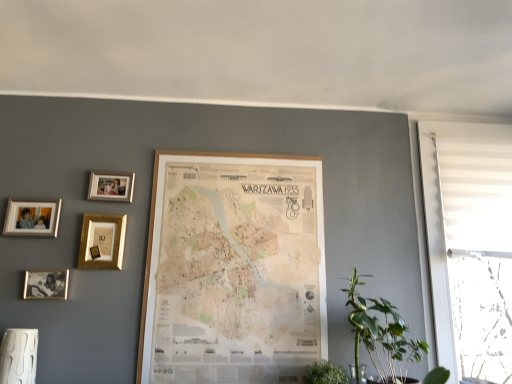
Question: Should I look upward or downward to see wooden map at center, which is the 1th picture frame from right to left?

Choices:
 (A) down
 (B) up

Answer: (A)

Question: Should I look upward or downward to see white fabric window at right?

Choices:
 (A) up
 (B) down

Answer: (B)

Question: Considering the relative sizes of gold metallic picture frame at upper left, arranged as the 3th picture frame when viewed from the right, and silver metallic photo frame at upper left, arranged as the 1th picture frame when viewed from the left, in the image provided, is gold metallic picture frame at upper left, arranged as the 3th picture frame when viewed from the right, shorter than silver metallic photo frame at upper left, arranged as the 1th picture frame when viewed from the left,?

Choices:
 (A) yes
 (B) no

Answer: (B)

Question: Is gold metallic picture frame at upper left, arranged as the 3th picture frame when viewed from the right, thinner than silver metallic photo frame at upper left, the 5th picture frame when ordered from right to left?

Choices:
 (A) no
 (B) yes

Answer: (A)

Question: Considering the relative sizes of gold metallic picture frame at upper left, placed as the third picture frame when sorted from left to right, and silver metallic photo frame at upper left, arranged as the 1th picture frame when viewed from the left, in the image provided, is gold metallic picture frame at upper left, placed as the third picture frame when sorted from left to right, wider than silver metallic photo frame at upper left, arranged as the 1th picture frame when viewed from the left,?

Choices:
 (A) yes
 (B) no

Answer: (A)

Question: From the image's perspective, would you say gold metallic picture frame at upper left, placed as the third picture frame when sorted from left to right, is shown under silver metallic photo frame at upper left, arranged as the 1th picture frame when viewed from the left?

Choices:
 (A) yes
 (B) no

Answer: (A)

Question: Can you confirm if gold metallic picture frame at upper left, arranged as the 3th picture frame when viewed from the right, is bigger than silver metallic photo frame at upper left, the 5th picture frame when ordered from right to left?

Choices:
 (A) yes
 (B) no

Answer: (A)

Question: Can you confirm if gold metallic picture frame at upper left, placed as the third picture frame when sorted from left to right, is smaller than silver metallic photo frame at upper left, arranged as the 1th picture frame when viewed from the left?

Choices:
 (A) yes
 (B) no

Answer: (B)

Question: Is green leafy plant at lower right behind gold metallic photo frame at upper left, the second picture frame in the right-to-left sequence?

Choices:
 (A) no
 (B) yes

Answer: (A)

Question: From a real-world perspective, is green leafy plant at lower right positioned over gold metallic photo frame at upper left, the second picture frame in the right-to-left sequence, based on gravity?

Choices:
 (A) no
 (B) yes

Answer: (A)

Question: Is gold metallic photo frame at upper left, the 4th picture frame positioned from the left, surrounded by green leafy plant at lower right?

Choices:
 (A) yes
 (B) no

Answer: (B)

Question: From the image's perspective, is green leafy plant at lower right above gold metallic photo frame at upper left, the second picture frame in the right-to-left sequence?

Choices:
 (A) yes
 (B) no

Answer: (B)

Question: Is green leafy plant at lower right oriented towards gold metallic photo frame at upper left, the 4th picture frame positioned from the left?

Choices:
 (A) yes
 (B) no

Answer: (B)

Question: Does green leafy plant at lower right have a lesser height compared to gold metallic photo frame at upper left, the 4th picture frame positioned from the left?

Choices:
 (A) no
 (B) yes

Answer: (A)

Question: Can you confirm if green leafy plant at lower right is bigger than white fabric window at right?

Choices:
 (A) no
 (B) yes

Answer: (A)